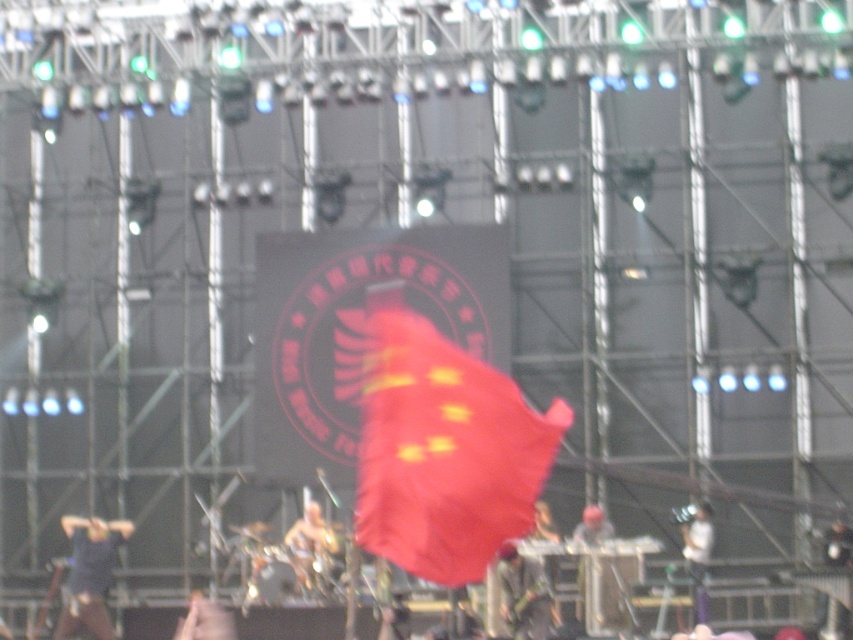
The height and width of the screenshot is (640, 853). Describe the element at coordinates (90, 573) in the screenshot. I see `dark blue fabric at lower left` at that location.

Can you confirm if dark blue fabric at lower left is positioned to the right of metallic gold helmet at center?

Incorrect, dark blue fabric at lower left is not on the right side of metallic gold helmet at center.

Does point (91, 520) come behind point (328, 582)?

Yes.

This screenshot has width=853, height=640. What are the coordinates of `dark blue fabric at lower left` in the screenshot? It's located at (90, 573).

Is dark blue fabric at lower left to the left of dark gray fabric at lower center from the viewer's perspective?

Yes, dark blue fabric at lower left is to the left of dark gray fabric at lower center.

Is dark blue fabric at lower left to the right of dark gray fabric at lower center from the viewer's perspective?

Incorrect, dark blue fabric at lower left is not on the right side of dark gray fabric at lower center.

I want to click on dark blue fabric at lower left, so click(90, 573).

Can you confirm if metallic gold helmet at center is positioned to the left of smooth white shirt at center?

Correct, you'll find metallic gold helmet at center to the left of smooth white shirt at center.

In the scene shown: Can you confirm if metallic gold helmet at center is smaller than smooth white shirt at center?

No, metallic gold helmet at center is not smaller than smooth white shirt at center.

Is point (311, 506) positioned after point (589, 513)?

That is True.

The image size is (853, 640). In order to click on metallic gold helmet at center in this screenshot , I will do `click(312, 548)`.